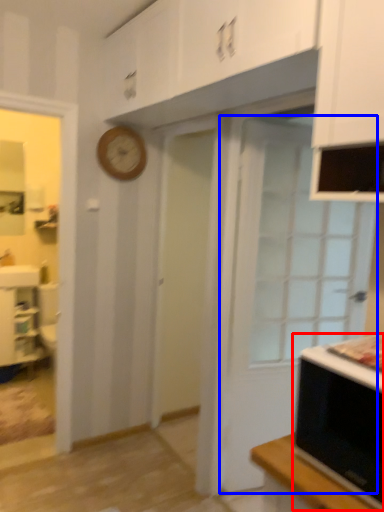
Question: Which object is further to the camera taking this photo, microwave oven (highlighted by a red box) or door (highlighted by a blue box)?

Choices:
 (A) microwave oven
 (B) door

Answer: (B)